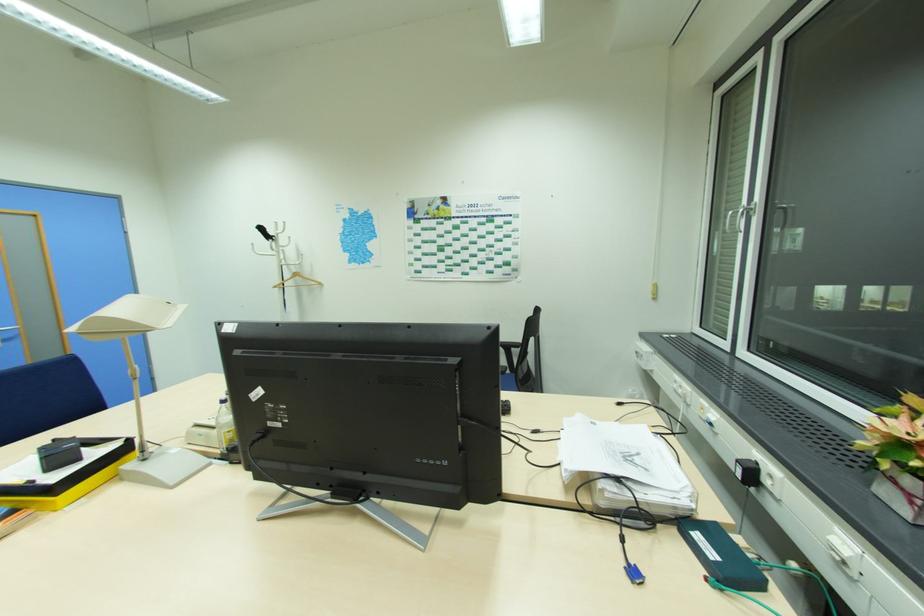
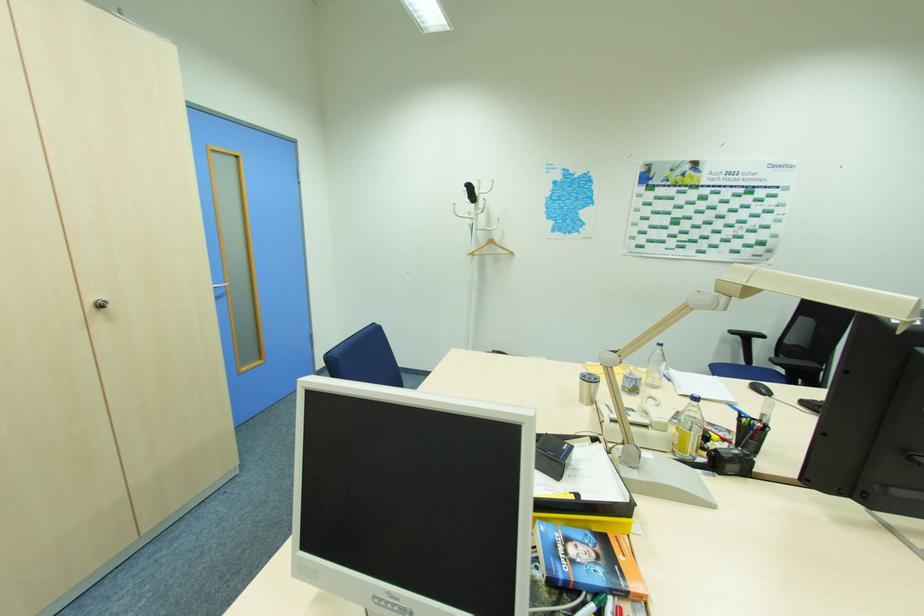
In the second image, find the point that corresponds to pixel 54 469 in the first image.

(561, 476)